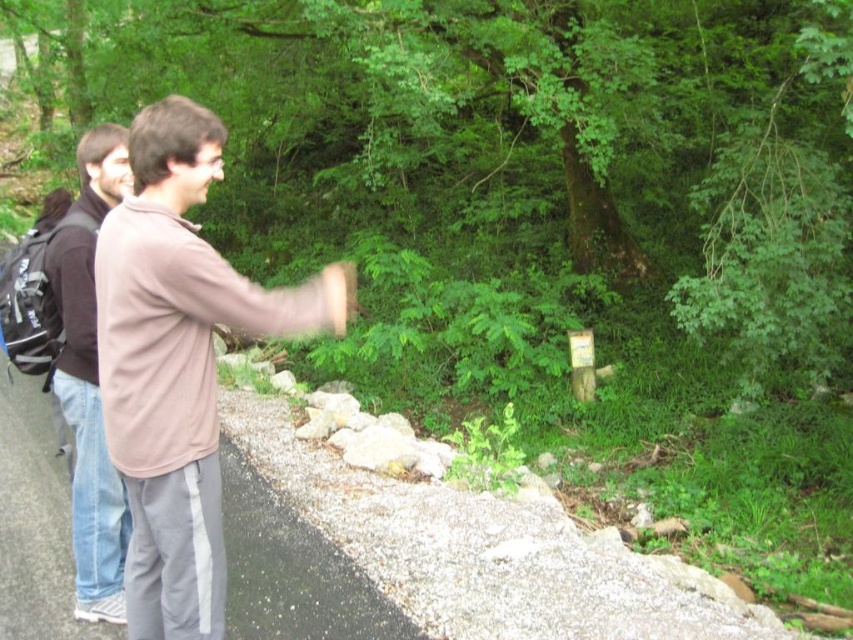
Does light brown cotton shirt at center appear under brown cotton hoodie at left?

Actually, light brown cotton shirt at center is above brown cotton hoodie at left.

Does light brown cotton shirt at center have a lesser width compared to brown cotton hoodie at left?

No, light brown cotton shirt at center is not thinner than brown cotton hoodie at left.

Find the location of `light brown cotton shirt at center`. light brown cotton shirt at center is located at coordinates (180, 364).